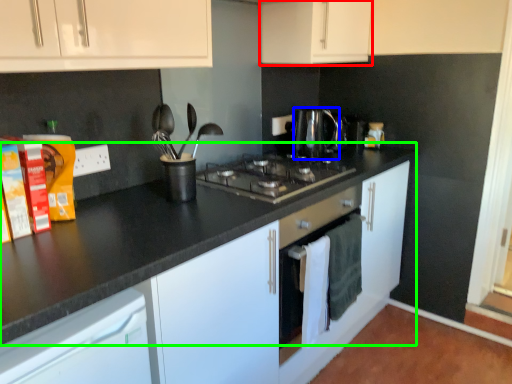
Question: Considering the real-world distances, which object is farthest from cabinetry (highlighted by a red box)? kitchen appliance (highlighted by a blue box) or counter top (highlighted by a green box)?

Choices:
 (A) kitchen appliance
 (B) counter top

Answer: (B)